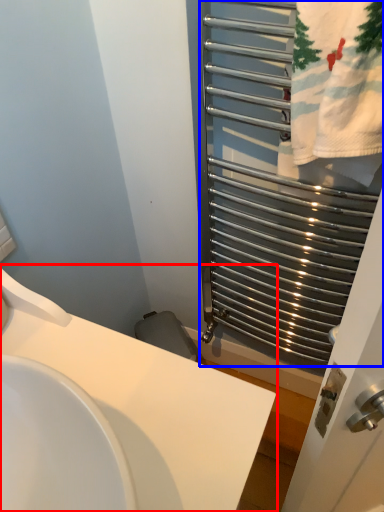
Question: Which object appears farthest to the camera in this image, sink (highlighted by a red box) or cage (highlighted by a blue box)?

Choices:
 (A) sink
 (B) cage

Answer: (B)